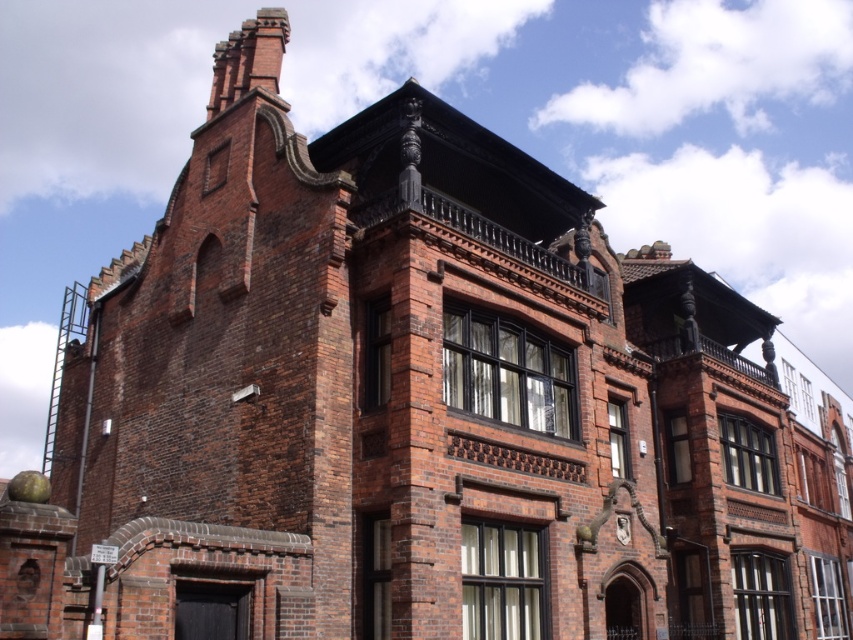
Question: Which object appears closest to the camera in this image?

Choices:
 (A) red brick chimney at upper left
 (B) matte stone clock at upper center

Answer: (B)

Question: Can you confirm if red brick chimney at upper left is thinner than matte stone clock at upper center?

Choices:
 (A) no
 (B) yes

Answer: (A)

Question: Which of the following is the closest to the observer?

Choices:
 (A) (630, 518)
 (B) (260, 65)

Answer: (A)

Question: Is the position of red brick chimney at upper left more distant than that of matte stone clock at upper center?

Choices:
 (A) yes
 (B) no

Answer: (A)

Question: Is red brick chimney at upper left above matte stone clock at upper center?

Choices:
 (A) yes
 (B) no

Answer: (A)